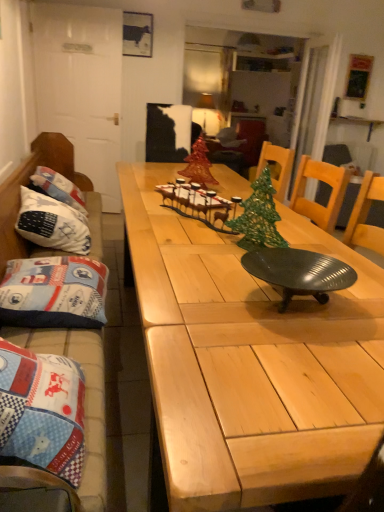
Locate an element on the screen. Image resolution: width=384 pixels, height=512 pixels. free space in front of green metallic christmas tree at center, the first christmas tree from the right is located at coordinates (225, 267).